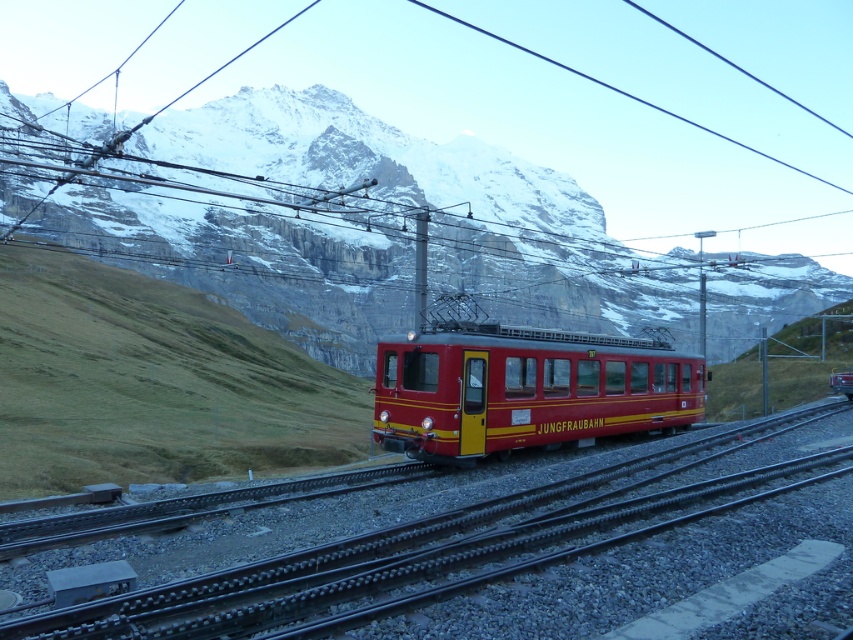
Based on the photo, you are a photographer wanting to capture the entire matte red train at center and the snowy rock at center in a single frame. Based on their sizes, which object should you focus on to ensure both are fully visible?

The snowy rock at center has a larger width than the matte red train at center. To ensure both are fully visible, focus on the snowy rock at center as it occupies more space in the frame.

Based on the scene description, what are the coordinates of the metallic train track at center?

The coordinates of the metallic train track at center are at point (x=450, y=547).